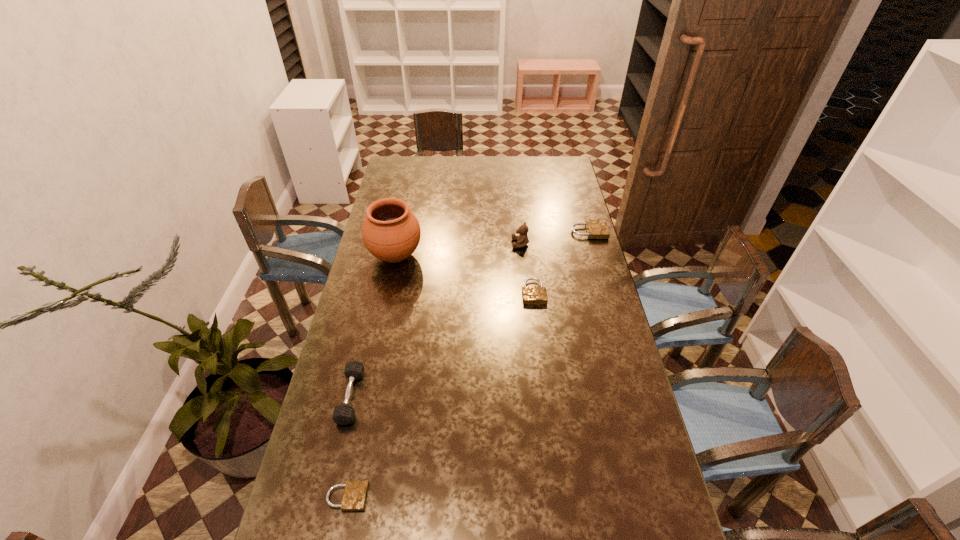
Image resolution: width=960 pixels, height=540 pixels. In order to click on vacant area situated 0.190m on the keyhole side of the nearest padlock in this screenshot , I will do `click(443, 497)`.

Locate an element on the screen. free space located on the keyhole side of the second padlock from left to right is located at coordinates (545, 391).

Identify the location of vacant area situated 0.110m on the front of the tallest object. The width and height of the screenshot is (960, 540). (387, 296).

Find the location of a particular element. This screenshot has width=960, height=540. free space located on the front-facing side of the teddy bear is located at coordinates (446, 244).

Identify the location of vacant space situated 0.270m on the front-facing side of the teddy bear. The image size is (960, 540). (446, 244).

What are the coordinates of `free spot located 0.330m on the front-facing side of the teddy bear` in the screenshot? It's located at (432, 244).

At what (x,y) coordinates should I click in order to perform the action: click on vacant space situated 0.070m on the right of the dumbbell. Please return your answer as a coordinate pair (x, y). Looking at the image, I should click on (383, 396).

Find the location of a particular element. The width and height of the screenshot is (960, 540). object positioned at the near edge is located at coordinates (355, 494).

Find the location of a particular element. This screenshot has height=540, width=960. padlock that is at the left edge is located at coordinates (355, 494).

Where is `pottery that is at the left edge`? The height and width of the screenshot is (540, 960). pottery that is at the left edge is located at coordinates (390, 232).